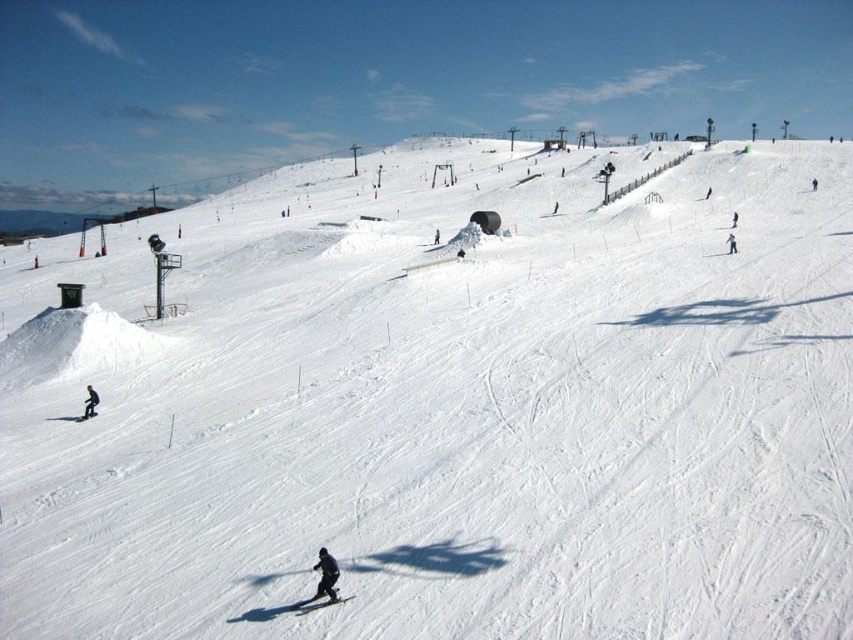
Between dark blue snowboarder at center and black matte ski at lower center, which one appears on the left side from the viewer's perspective?

black matte ski at lower center

I want to click on dark blue snowboarder at center, so click(x=323, y=579).

Which of these two, black matte snowboarder at lower left or black snowsuit at center-right, stands shorter?

black matte snowboarder at lower left

Measure the distance from black matte snowboarder at lower left to black snowsuit at center-right.

A distance of 44.38 meters exists between black matte snowboarder at lower left and black snowsuit at center-right.

At what (x,y) coordinates should I click in order to perform the action: click on black matte snowboarder at lower left. Please return your answer as a coordinate pair (x, y). Looking at the image, I should click on (90, 403).

Is black matte snowboarder at center closer to camera compared to black matte snowboarder at lower left?

Yes, it is in front of black matte snowboarder at lower left.

Does point (323, 570) lie behind point (88, 406)?

No, (323, 570) is in front of (88, 406).

Locate an element on the screen. Image resolution: width=853 pixels, height=640 pixels. black matte snowboarder at center is located at coordinates (326, 576).